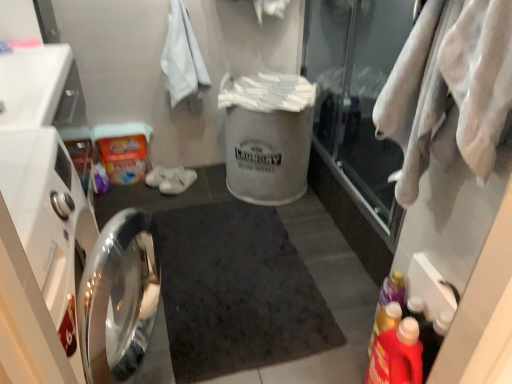
Question: From the image's perspective, is dark matte bath mat at center located above or below white fabric bag at center?

Choices:
 (A) above
 (B) below

Answer: (B)

Question: Is dark matte bath mat at center in front of or behind white fabric bag at center in the image?

Choices:
 (A) front
 (B) behind

Answer: (A)

Question: Considering the real-world distances, which object is closest to the white cotton bath towel at upper left?

Choices:
 (A) white fabric bag at center
 (B) white cotton towel at right
 (C) polished stainless steel dishwasher at left
 (D) transparent glass door at upper right
 (E) dark matte bath mat at center

Answer: (A)

Question: Based on their relative distances, which object is nearer to the polished stainless steel dishwasher at left?

Choices:
 (A) white cotton towel at right
 (B) white cotton bath towel at upper left
 (C) white fabric bag at center
 (D) red plastic detergent at lower right, which appears as the first bottle when viewed from the front
 (E) translucent plastic detergent at lower right, the 2th bottle when ordered from front to back

Answer: (B)